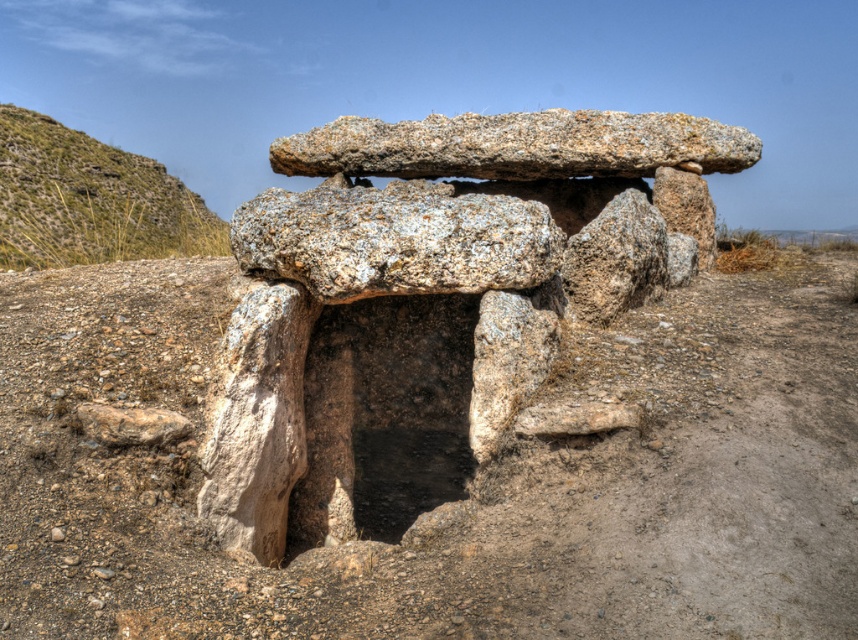
Question: Which object is closer to the camera taking this photo?

Choices:
 (A) green grassy hill at upper left
 (B) granite rock formation at center

Answer: (B)

Question: Does granite rock formation at center have a lesser width compared to green grassy hill at upper left?

Choices:
 (A) yes
 (B) no

Answer: (B)

Question: From the image, what is the correct spatial relationship of granite rock formation at center in relation to green grassy hill at upper left?

Choices:
 (A) right
 (B) left

Answer: (A)

Question: Among these objects, which one is nearest to the camera?

Choices:
 (A) green grassy hill at upper left
 (B) granite rock formation at center

Answer: (B)

Question: Does granite rock formation at center have a larger size compared to green grassy hill at upper left?

Choices:
 (A) yes
 (B) no

Answer: (A)